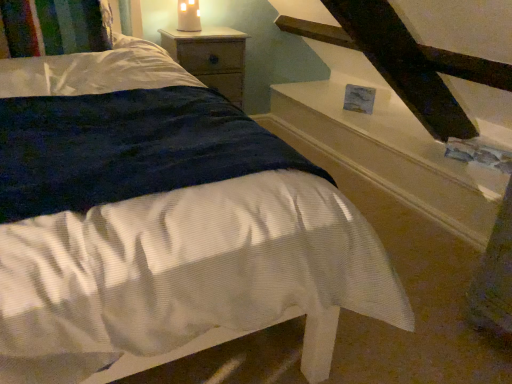
Question: Is wooden nightstand at upper center taller or shorter than matte white candle at upper center?

Choices:
 (A) short
 (B) tall

Answer: (B)

Question: Do you think wooden nightstand at upper center is within matte white candle at upper center, or outside of it?

Choices:
 (A) outside
 (B) inside

Answer: (A)

Question: Which of these objects is positioned closest to the wooden nightstand at upper center?

Choices:
 (A) white glossy stairwell at upper right
 (B) multicolored knitted pillow at upper left
 (C) matte white candle at upper center

Answer: (C)

Question: Considering the real-world distances, which object is farthest from the matte white candle at upper center?

Choices:
 (A) white glossy stairwell at upper right
 (B) wooden nightstand at upper center
 (C) multicolored knitted pillow at upper left

Answer: (A)